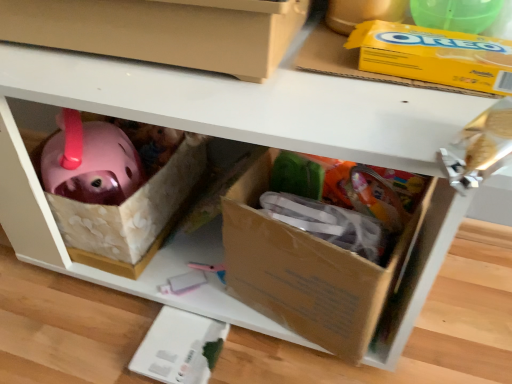
Question: Can you confirm if yellow cardboard box at upper right is bigger than matte cardboard box at center, which ranks as the 2th box in bottom-to-top order?

Choices:
 (A) yes
 (B) no

Answer: (B)

Question: Does yellow cardboard box at upper right appear on the left side of matte cardboard box at center, which ranks as the 2th box in bottom-to-top order?

Choices:
 (A) no
 (B) yes

Answer: (A)

Question: Considering the relative positions of yellow cardboard box at upper right and matte cardboard box at center, arranged as the first box when viewed from the top, in the image provided, is yellow cardboard box at upper right behind matte cardboard box at center, arranged as the first box when viewed from the top,?

Choices:
 (A) yes
 (B) no

Answer: (A)

Question: Is yellow cardboard box at upper right in front of matte cardboard box at center, which ranks as the 2th box in bottom-to-top order?

Choices:
 (A) yes
 (B) no

Answer: (B)

Question: Is yellow cardboard box at upper right smaller than matte cardboard box at center, which ranks as the 2th box in bottom-to-top order?

Choices:
 (A) no
 (B) yes

Answer: (B)

Question: From the image's perspective, is cardboard box at lower right, the first box from the bottom, located above or below matte cardboard box at center, which ranks as the 2th box in bottom-to-top order?

Choices:
 (A) below
 (B) above

Answer: (A)

Question: Looking at their shapes, would you say cardboard box at lower right, the first box from the bottom, is wider or thinner than matte cardboard box at center, arranged as the first box when viewed from the top?

Choices:
 (A) thin
 (B) wide

Answer: (A)

Question: From a real-world perspective, is cardboard box at lower right, the second box when ordered from top to bottom, positioned above or below matte cardboard box at center, arranged as the first box when viewed from the top?

Choices:
 (A) above
 (B) below

Answer: (B)

Question: Looking at the image, does cardboard box at lower right, the second box when ordered from top to bottom, seem bigger or smaller compared to matte cardboard box at center, which ranks as the 2th box in bottom-to-top order?

Choices:
 (A) big
 (B) small

Answer: (B)

Question: Looking at their shapes, would you say cardboard box at lower right, the first box from the bottom, is wider or thinner than yellow cardboard box at upper right?

Choices:
 (A) thin
 (B) wide

Answer: (B)

Question: Considering the positions of cardboard box at lower right, the second box when ordered from top to bottom, and yellow cardboard box at upper right in the image, is cardboard box at lower right, the second box when ordered from top to bottom, taller or shorter than yellow cardboard box at upper right?

Choices:
 (A) short
 (B) tall

Answer: (B)

Question: Do you think cardboard box at lower right, the first box from the bottom, is within yellow cardboard box at upper right, or outside of it?

Choices:
 (A) outside
 (B) inside

Answer: (A)

Question: Does point (315, 296) appear closer or farther from the camera than point (485, 41)?

Choices:
 (A) farther
 (B) closer

Answer: (A)

Question: From a real-world perspective, is matte cardboard box at center, which ranks as the 2th box in bottom-to-top order, physically located above or below yellow cardboard box at upper right?

Choices:
 (A) below
 (B) above

Answer: (B)

Question: From the image's perspective, relative to yellow cardboard box at upper right, is matte cardboard box at center, which ranks as the 2th box in bottom-to-top order, above or below?

Choices:
 (A) below
 (B) above

Answer: (B)